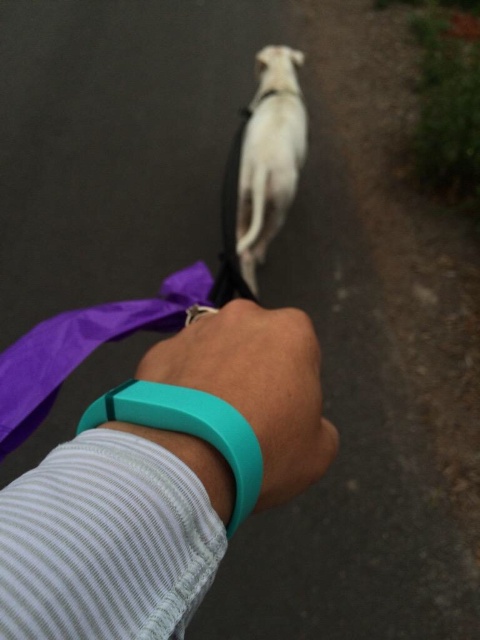
Question: Which object appears closest to the camera in this image?

Choices:
 (A) teal rubber band at center
 (B) teal rubber wristband at center
 (C) teal rubber band at lower center
 (D) purple fabric leash at center

Answer: (B)

Question: Considering the relative positions of white fur dog at center and teal rubber band at lower center in the image provided, where is white fur dog at center located with respect to teal rubber band at lower center?

Choices:
 (A) left
 (B) right

Answer: (B)

Question: In this image, where is teal rubber band at center located relative to white fur dog at center?

Choices:
 (A) right
 (B) left

Answer: (B)

Question: Which point appears closest to the camera in this image?

Choices:
 (A) (207, 493)
 (B) (260, 173)
 (C) (40, 467)

Answer: (A)

Question: Among these points, which one is farthest from the camera?

Choices:
 (A) (255, 372)
 (B) (231, 282)
 (C) (220, 404)

Answer: (B)

Question: Does white fur dog at center appear over teal rubber band at lower center?

Choices:
 (A) yes
 (B) no

Answer: (A)